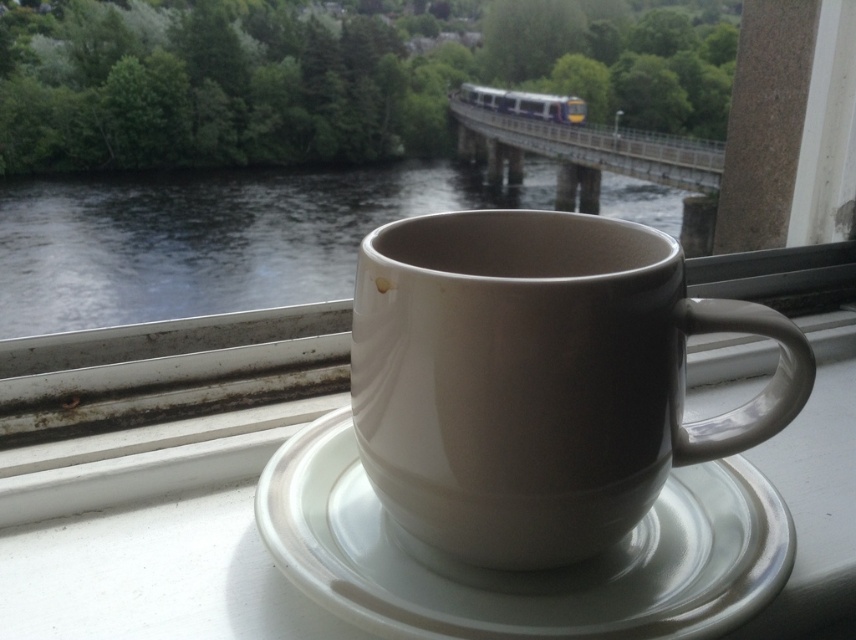
You are standing in front of the window and want to reach the point marked as point [535,568] on the windowsill. If your hand can extend 18 inches forward, can you comfortably reach that point?

The point [535,568] is 17.75 inches away from the viewer. Since your hand can extend 18 inches forward, you can comfortably reach that point as it is within your reach.

You are a bird flying over the scene. You see the white glossy saucer at center and the dark water at center. Which one is closer to you?

The dark water at center is closer to you because the white glossy saucer at center is positioned under it.